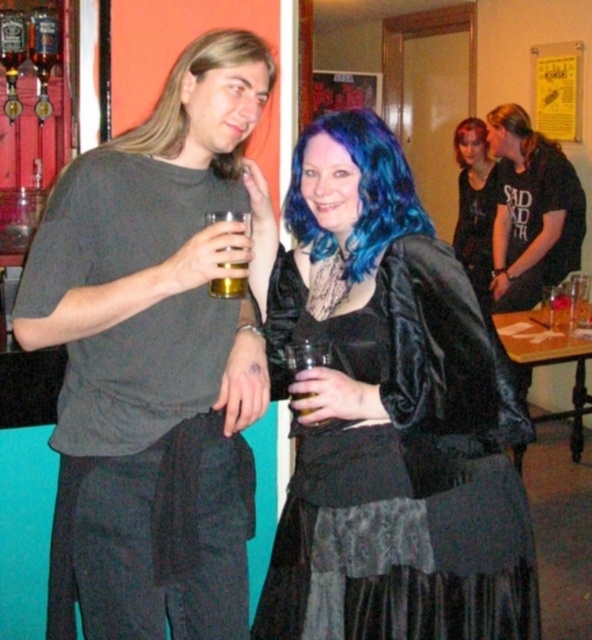
In the scene described, there is a point marked at coordinates (474, 205). Which object from the list corresponds to this point?

The point at (474, 205) corresponds to the shiny black shirt at upper right.

You are a photographer standing at the center of the bar. You want to take a photo of the shiny black shirt at upper right and the translucent glass beer at center. Can you fit both subjects into your camera frame if your camera has a maximum horizontal field of view of 3 meters?

The distance between the shiny black shirt at upper right and the translucent glass beer at center is 3.74 meters, which exceeds the camera frame of 3 meters. Therefore, you cannot fit both subjects into the frame.